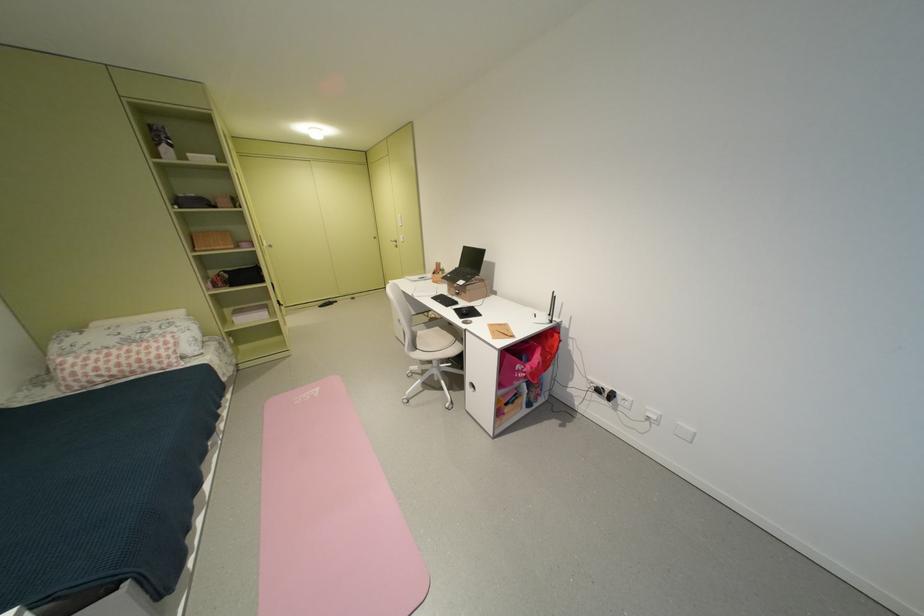
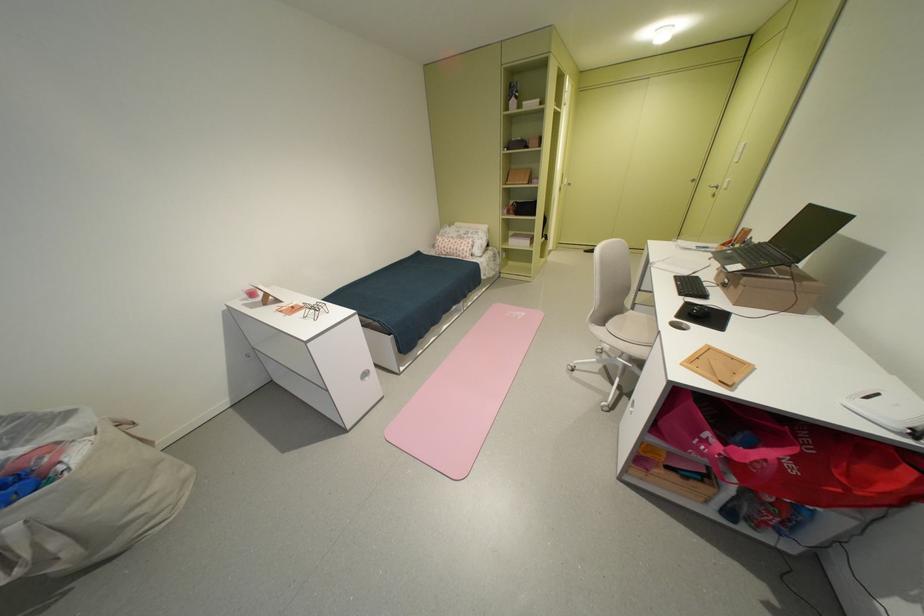
Find the pixel in the second image that matches [405,244] in the first image.

(724, 190)